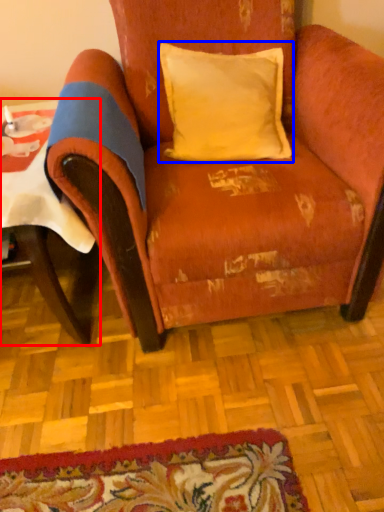
Question: Among these objects, which one is farthest to the camera, table (highlighted by a red box) or pillow (highlighted by a blue box)?

Choices:
 (A) table
 (B) pillow

Answer: (B)